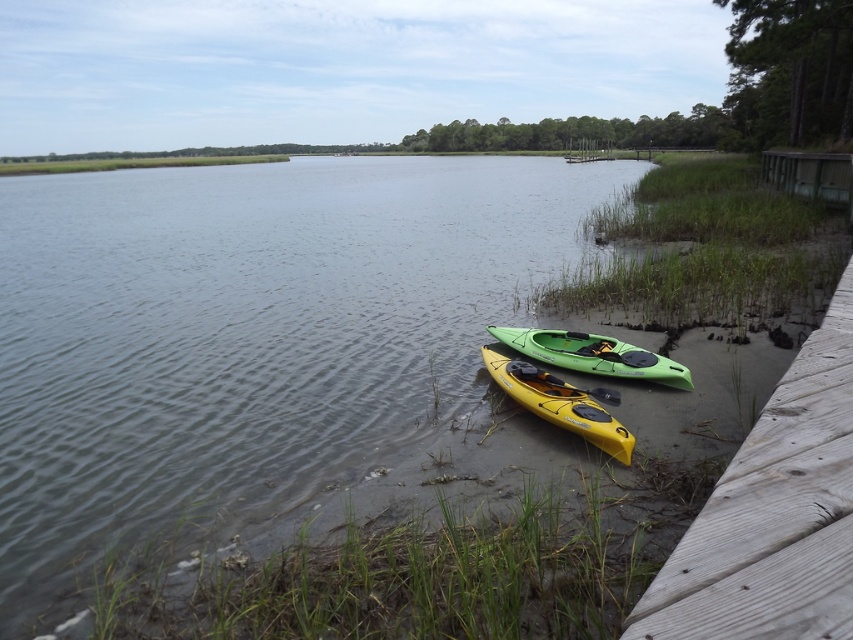
You are standing on the wooden dock and want to choose between the green plastic kayak at lower center and the green plastic canoe at lower center. Which one is positioned to the left?

The green plastic kayak at lower center is positioned to the left of the green plastic canoe at lower center.

In the scene shown: You are standing on the lakeside and want to pick up the yellow matte paddle at lower center. Can you easily reach it without moving the wooden at lower right?

The wooden at lower right is much taller than the yellow matte paddle at lower center, so it might block your direct access to the paddle. You may need to move the wooden object first to reach the paddle.